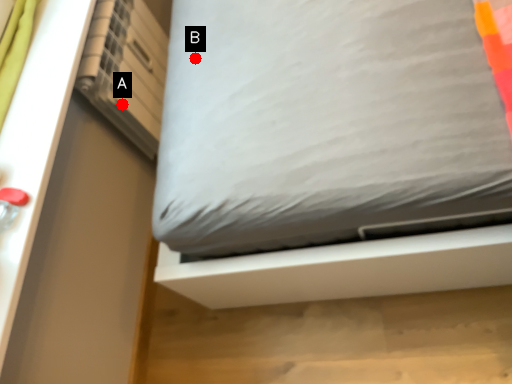
Question: Two points are circled on the image, labeled by A and B beside each circle. Which point is further to the camera?

Choices:
 (A) A is further
 (B) B is further

Answer: (A)